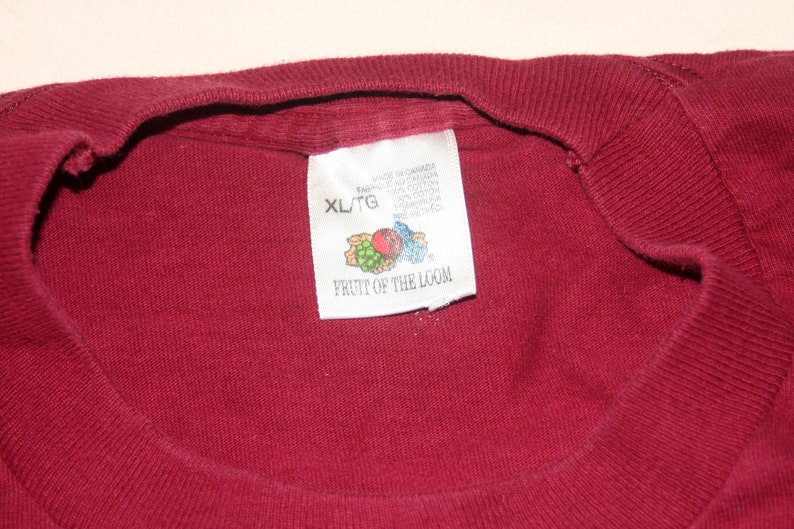
You are a GUI agent. You are given a task and a screenshot of the screen. Output one action in this format:
    pyautogui.click(x=<x>, y=<y>)
    Task: Click on the table
    The height and width of the screenshot is (529, 794).
    Given the screenshot: What is the action you would take?
    pyautogui.click(x=144, y=66)